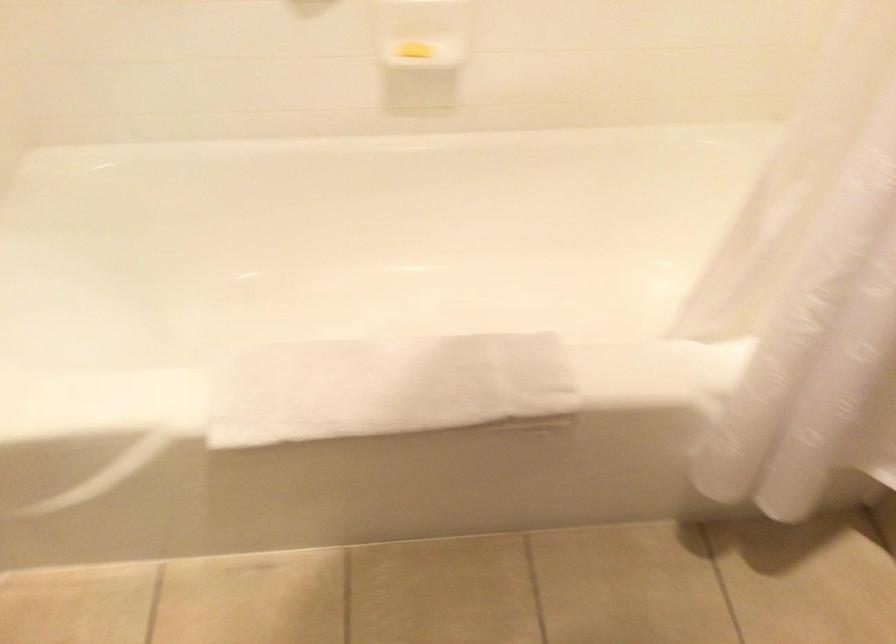
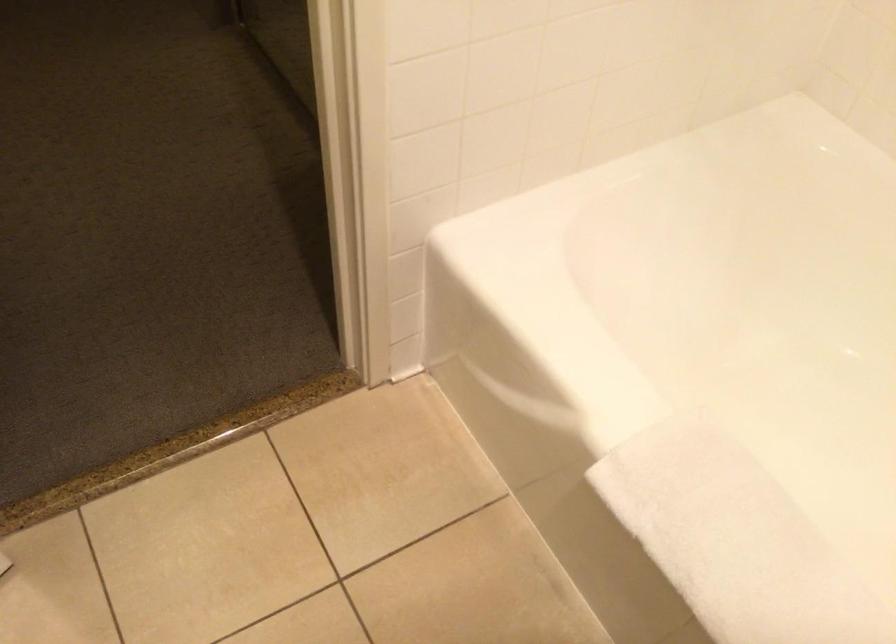
Locate, in the second image, the point that corresponds to [325,384] in the first image.

(736, 541)